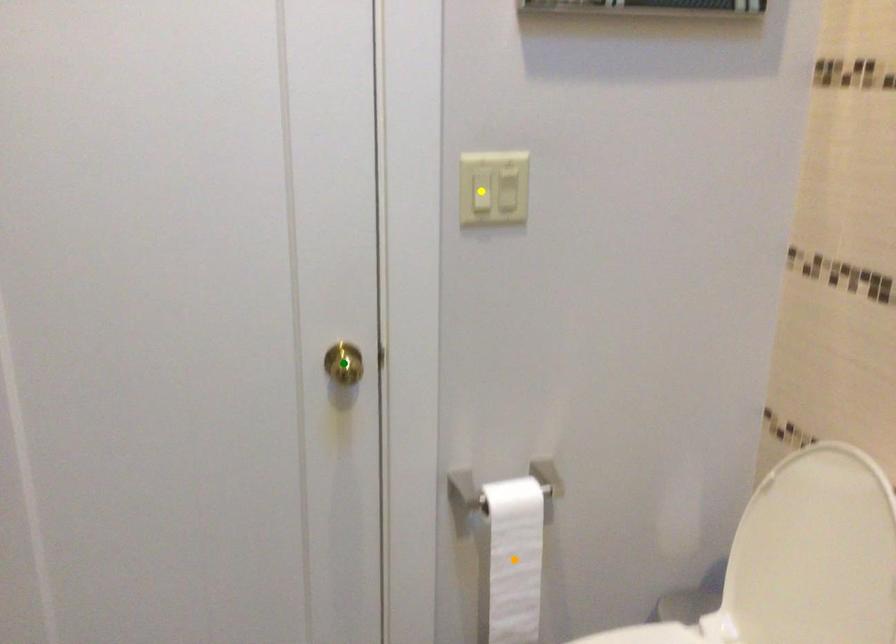
Order these from farthest to nearest:
yellow point
orange point
green point

orange point
green point
yellow point